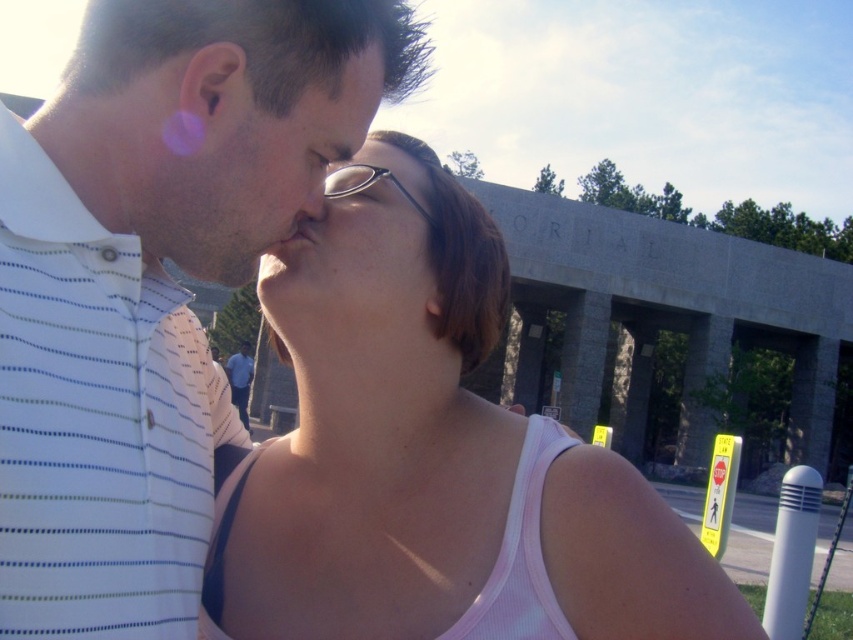
Question: Is pink fabric tank top at center above matte black glasses at center?

Choices:
 (A) yes
 (B) no

Answer: (B)

Question: Which is nearer to the blue striped shirt at center?

Choices:
 (A) white striped polo shirt at upper left
 (B) matte skin face at center

Answer: (B)

Question: Which of the following is the farthest from the observer?

Choices:
 (A) (225, 250)
 (B) (378, 58)

Answer: (B)

Question: Can you confirm if white striped polo shirt at upper left is smaller than blue striped shirt at center?

Choices:
 (A) no
 (B) yes

Answer: (B)

Question: Is white striped polo shirt at upper left wider than matte skin face at center?

Choices:
 (A) yes
 (B) no

Answer: (A)

Question: Among these objects, which one is farthest from the camera?

Choices:
 (A) pink fabric tank top at center
 (B) matte black nose at center

Answer: (A)